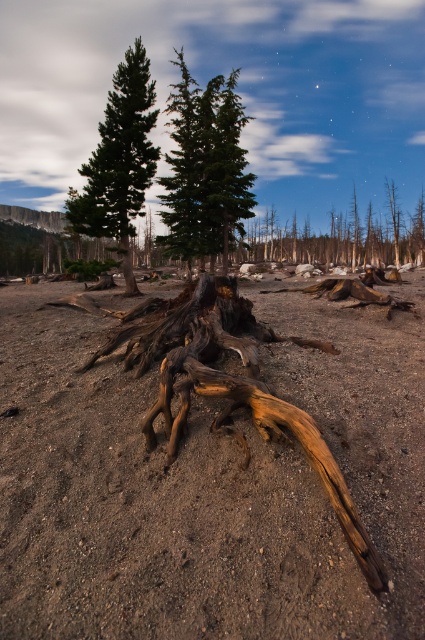
Based on the photo, you are an environmental scientist observing the landscape. You notice the green matte tree at center and the brown rough tree trunk at center. Which object is closer to the observer?

The green matte tree at center is positioned over brown rough tree trunk at center, so the green matte tree at center is closer to the observer.

You are a photographer positioned at the camera viewpoint. You want to capture a photo that includes both the point at coordinates point [180,54] and point [119,252]. Which point will appear closer to the front of the photo?

Point point [180,54] is further to the camera than point point [119,252], so in the photo, point point [180,54] will appear closer to the front of the photo.

You are a hiker who needs to cross the area shown in the image. You have a map that marks the brown dirt field at center and the charred wood tree stump at center. According to the map, which one is closer to your current position if you are standing at the edge of the image facing towards the scene?

The brown dirt field at center is in front of the charred wood tree stump at center, so the brown dirt field at center is closer to your current position.